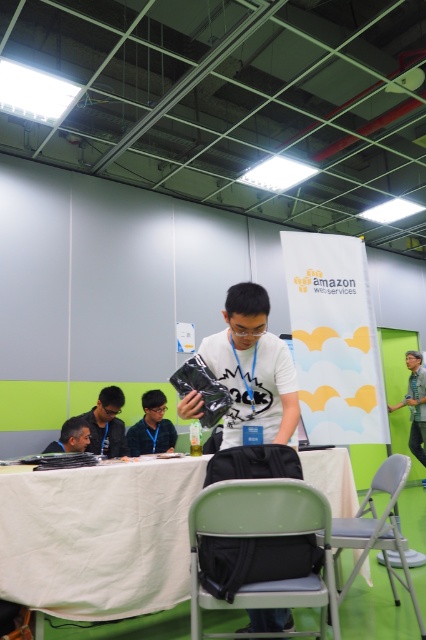
Question: Is gray fabric chair at lower center bigger than dark gray shirt at lower left?

Choices:
 (A) yes
 (B) no

Answer: (A)

Question: Does gray fabric chair at lower center have a smaller size compared to matte black shirt at center?

Choices:
 (A) yes
 (B) no

Answer: (B)

Question: Among these points, which one is farthest from the camera?

Choices:
 (A) (2, 531)
 (B) (420, 406)

Answer: (B)

Question: Is white matte shirt at center above dark gray shirt at lower left?

Choices:
 (A) yes
 (B) no

Answer: (A)

Question: Which object is the farthest from the green fabric shirt at right?

Choices:
 (A) dark gray shirt at lower left
 (B) matte black shirt at center
 (C) matte black laptop at left
 (D) white matte shirt at center

Answer: (D)

Question: Which point appears farthest from the camera in this image?

Choices:
 (A) (85, 435)
 (B) (268, 419)
 (C) (221, 502)

Answer: (A)